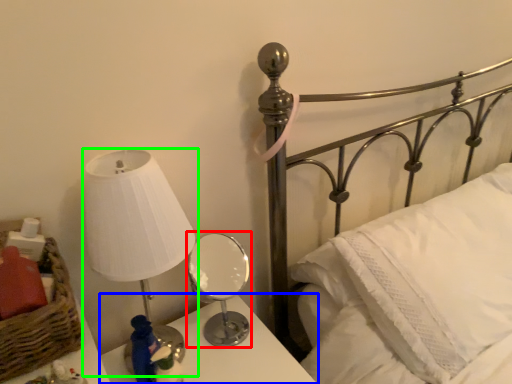
Question: Which object is the closest to the table lamp (highlighted by a red box)? Choose among these: nightstand (highlighted by a blue box) or lamp (highlighted by a green box).

Choices:
 (A) nightstand
 (B) lamp

Answer: (A)